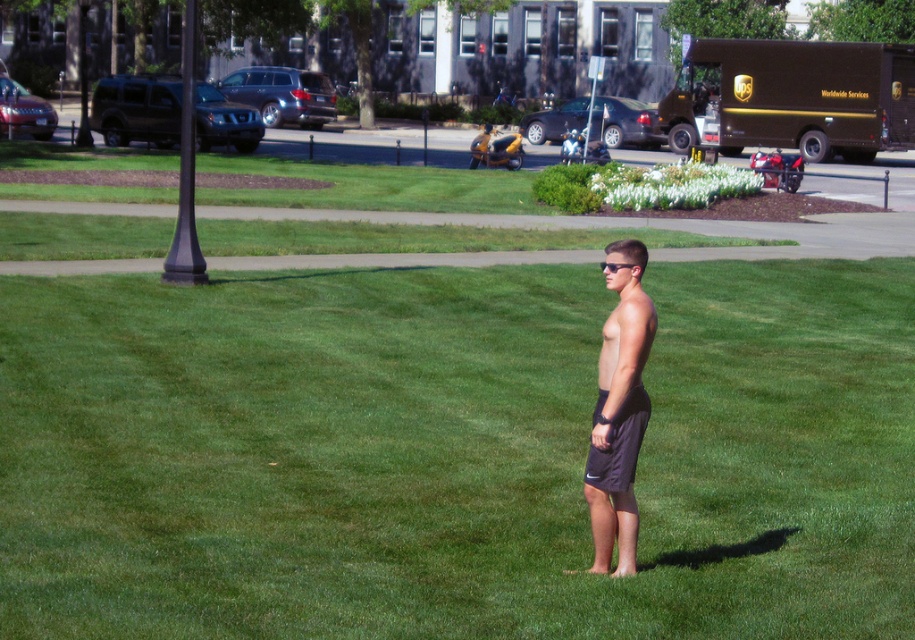
Is dark gray shorts at center shorter than black fabric shorts at center?

Incorrect, dark gray shorts at center's height does not fall short of black fabric shorts at center's.

Is dark gray shorts at center bigger than black fabric shorts at center?

Correct, dark gray shorts at center is larger in size than black fabric shorts at center.

Is point (621, 554) closer to viewer compared to point (619, 442)?

No, (621, 554) is further to viewer.

Find the location of a particular element. The height and width of the screenshot is (640, 915). dark gray shorts at center is located at coordinates (619, 410).